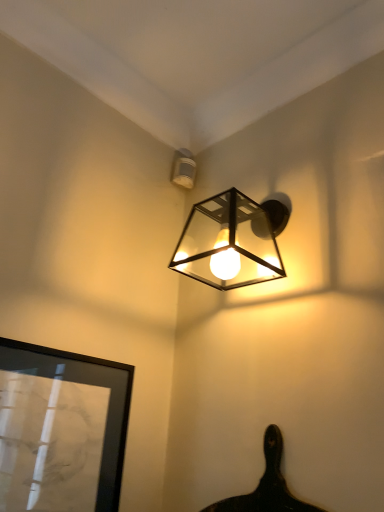
Question: From the image's perspective, relative to white plastic sensor at upper center, which is the second lamp in front-to-back order, is black glossy picture frame at lower left above or below?

Choices:
 (A) above
 (B) below

Answer: (B)

Question: Relative to white plastic sensor at upper center, the 1th lamp when ordered from back to front, is black glossy picture frame at lower left in front or behind?

Choices:
 (A) front
 (B) behind

Answer: (A)

Question: Which is farther from the black glossy picture frame at lower left?

Choices:
 (A) metallic cube-shaped light fixture at upper center, acting as the 1th lamp starting from the front
 (B) white plastic sensor at upper center, the second lamp when ordered from bottom to top

Answer: (B)

Question: Which of these objects is positioned closest to the metallic cube-shaped light fixture at upper center, the second lamp when ordered from back to front?

Choices:
 (A) white plastic sensor at upper center, acting as the 1th lamp starting from the top
 (B) black glossy picture frame at lower left

Answer: (A)